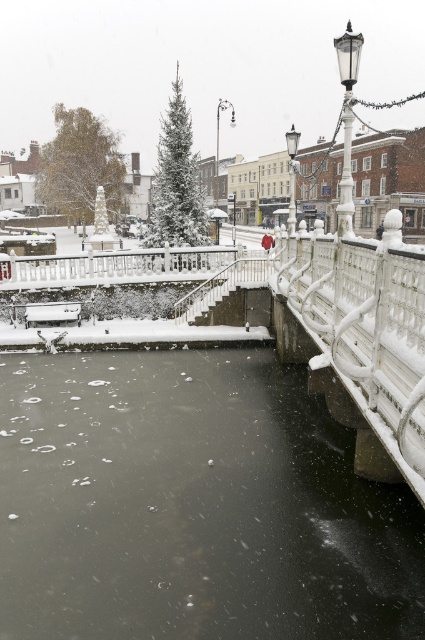
You are a photographer trying to capture the white glass lamp post at upper right and the black ice at center in the same frame. Based on their positions, which object should you adjust your camera to focus on first to ensure both are in the shot?

The black ice at center is positioned on the left side of white glass lamp post at upper right. Therefore, you should focus on the white glass lamp post at upper right first, as it is further to the right and adjusting the frame from left to right would naturally include both objects.

You are standing at the frozen canal in the town square and see two points marked on the ground. One is labeled as point (34, 582) and the other as point (223, 109). If you want to walk towards the point that is closer to you, which one should you head towards?

You should head towards point (34, 582) because it is in front of point (223, 109), meaning it is closer to you.